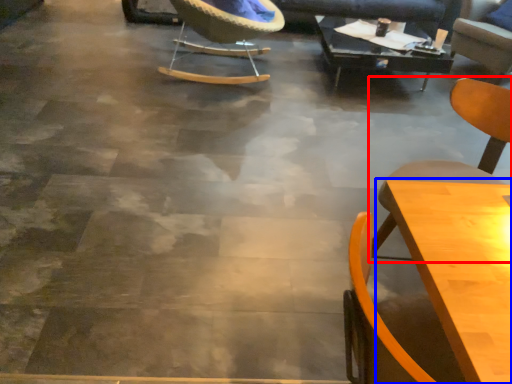
Question: Which of the following is the farthest to the observer, chair (highlighted by a red box) or table (highlighted by a blue box)?

Choices:
 (A) chair
 (B) table

Answer: (A)